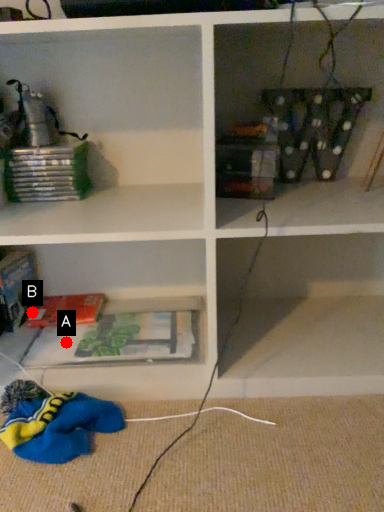
Question: Two points are circled on the image, labeled by A and B beside each circle. Which point is farther to the camera?

Choices:
 (A) A is further
 (B) B is further

Answer: (B)